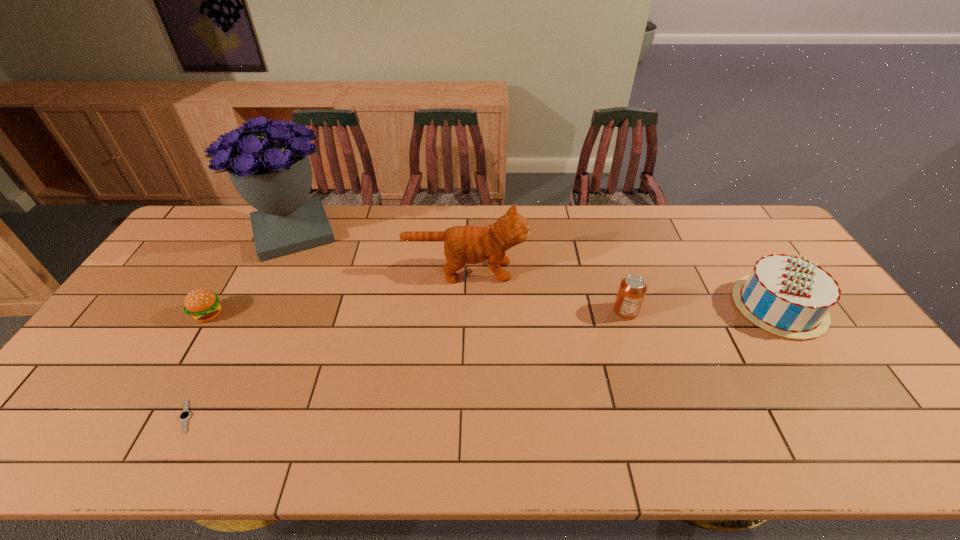
The width and height of the screenshot is (960, 540). Find the location of `vacant space located 0.190m on the front of the bouquet`. vacant space located 0.190m on the front of the bouquet is located at coordinates (257, 307).

Locate an element on the screen. The height and width of the screenshot is (540, 960). vacant space located 0.180m on the face of the cat is located at coordinates (583, 271).

Locate an element on the screen. This screenshot has width=960, height=540. vacant region located 0.170m on the left of the rightmost object is located at coordinates (677, 306).

This screenshot has width=960, height=540. Identify the location of vacant area located 0.050m on the back of the third shortest object. (619, 290).

Find the location of a particular element. The height and width of the screenshot is (540, 960). free region located 0.060m on the front of the hamburger is located at coordinates (191, 345).

Locate an element on the screen. free space located on the back of the nearest object is located at coordinates (254, 284).

Find the location of a particular element. Image resolution: width=960 pixels, height=540 pixels. object at the far edge is located at coordinates (272, 173).

Locate an element on the screen. This screenshot has width=960, height=540. object at the near edge is located at coordinates (184, 416).

Identify the location of object positioned at the right edge. Image resolution: width=960 pixels, height=540 pixels. (788, 296).

Image resolution: width=960 pixels, height=540 pixels. Find the location of `vacant space at the far edge of the desktop`. vacant space at the far edge of the desktop is located at coordinates (544, 221).